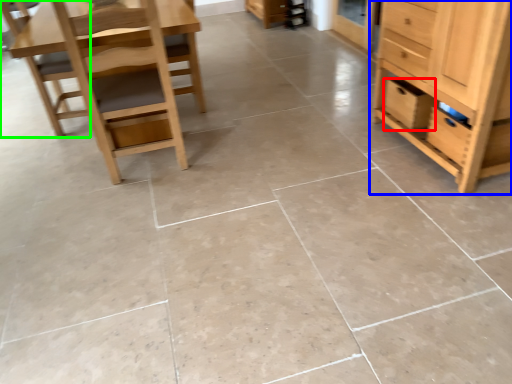
Question: Considering the real-world distances, which object is farthest from drawer (highlighted by a red box)? chest of drawers (highlighted by a blue box) or chair (highlighted by a green box)?

Choices:
 (A) chest of drawers
 (B) chair

Answer: (B)